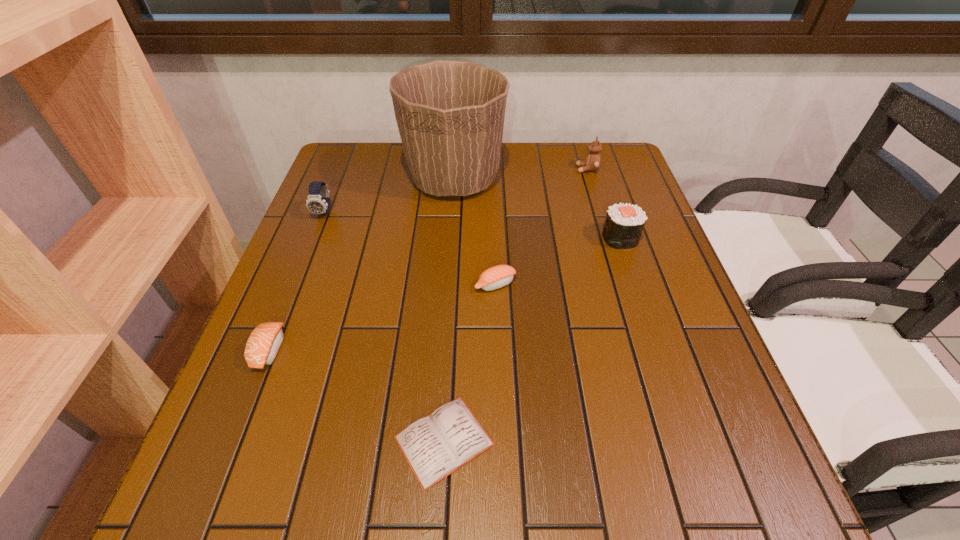
At what (x,y) coordinates should I click in order to perform the action: click on flowerpot present at the far edge. Please return your answer as a coordinate pair (x, y). Looking at the image, I should click on (450, 114).

At what (x,y) coordinates should I click in order to perform the action: click on teddy bear at the far edge. Please return your answer as a coordinate pair (x, y). Looking at the image, I should click on (592, 163).

Identify the location of object positioned at the near edge. (435, 446).

Where is `watch located in the left edge section of the desktop`? The image size is (960, 540). watch located in the left edge section of the desktop is located at coordinates (318, 202).

What are the coordinates of `sushi that is at the left edge` in the screenshot? It's located at (262, 346).

Identify the location of teddy bear present at the right edge. This screenshot has height=540, width=960. (592, 163).

You are a GUI agent. You are given a task and a screenshot of the screen. Output one action in this format:
    pyautogui.click(x=<x>, y=<y>)
    Task: Click on the sushi located at the right edge
    The height and width of the screenshot is (540, 960).
    Given the screenshot: What is the action you would take?
    pyautogui.click(x=624, y=223)

This screenshot has height=540, width=960. Identify the location of object situated at the far right corner. (592, 163).

What are the coordinates of `free space at the far edge of the desktop` in the screenshot? It's located at (568, 145).

Where is `vacant space at the near edge`? vacant space at the near edge is located at coordinates click(x=590, y=506).